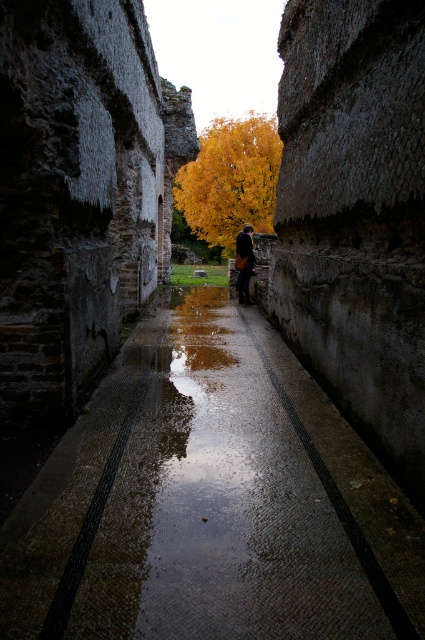
Question: Can you confirm if yellow leafy tree at center is positioned below leather brown bag at center?

Choices:
 (A) no
 (B) yes

Answer: (A)

Question: Which of the following is the closest to the observer?

Choices:
 (A) (238, 291)
 (B) (206, 308)
 (C) (221, 148)

Answer: (B)

Question: Considering the real-world distances, which object is closest to the yellow leafy tree at center?

Choices:
 (A) leather brown bag at center
 (B) wet concrete pavement at center

Answer: (A)

Question: Can you confirm if yellow leafy tree at center is wider than leather brown bag at center?

Choices:
 (A) yes
 (B) no

Answer: (A)

Question: Which object is positioned farthest from the yellow leafy tree at center?

Choices:
 (A) wet concrete pavement at center
 (B) leather brown bag at center

Answer: (A)

Question: Is wet concrete pavement at center thinner than leather brown bag at center?

Choices:
 (A) yes
 (B) no

Answer: (A)